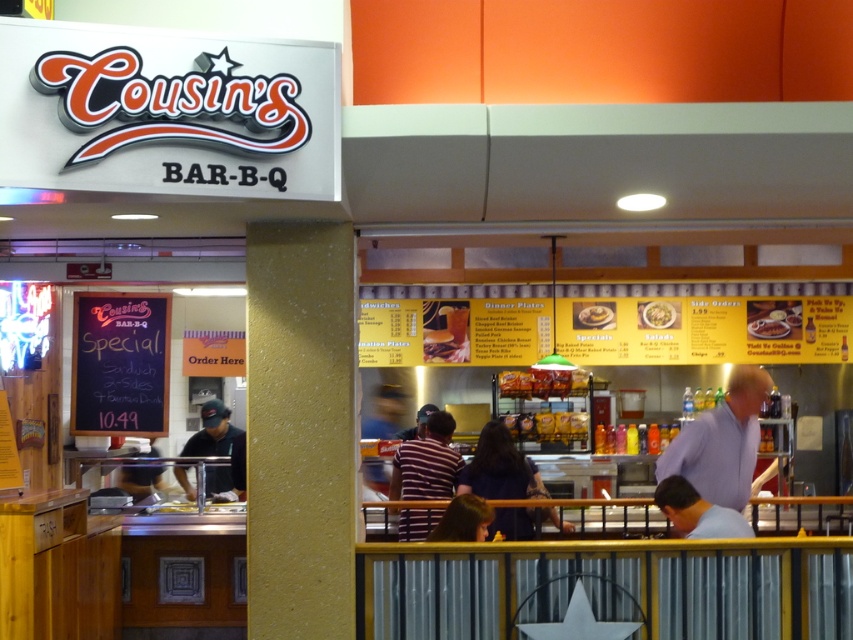
Where is `black chalkboard at center`? The height and width of the screenshot is (640, 853). black chalkboard at center is located at coordinates (120, 364).

This screenshot has width=853, height=640. What do you see at coordinates (120, 364) in the screenshot? I see `black chalkboard at center` at bounding box center [120, 364].

Image resolution: width=853 pixels, height=640 pixels. In order to click on black chalkboard at center in this screenshot , I will do `click(120, 364)`.

Does point (643, 314) come in front of point (426, 417)?

Yes, point (643, 314) is in front of point (426, 417).

Is white paper salad bowl at center smaller than dark blue baseball cap at center?

Yes, white paper salad bowl at center is smaller than dark blue baseball cap at center.

Is point (654, 323) positioned behind point (418, 422)?

That is False.

Where is `white paper salad bowl at center`? white paper salad bowl at center is located at coordinates (659, 314).

Which is below, striped shirt at center or yellow matte pancake at center?

striped shirt at center is lower down.

Does striped shirt at center appear over yellow matte pancake at center?

No, striped shirt at center is not above yellow matte pancake at center.

Between point (492, 436) and point (606, 323), which one is positioned behind?

The point (606, 323) is behind.

Where is `striped shirt at center`? striped shirt at center is located at coordinates (498, 467).